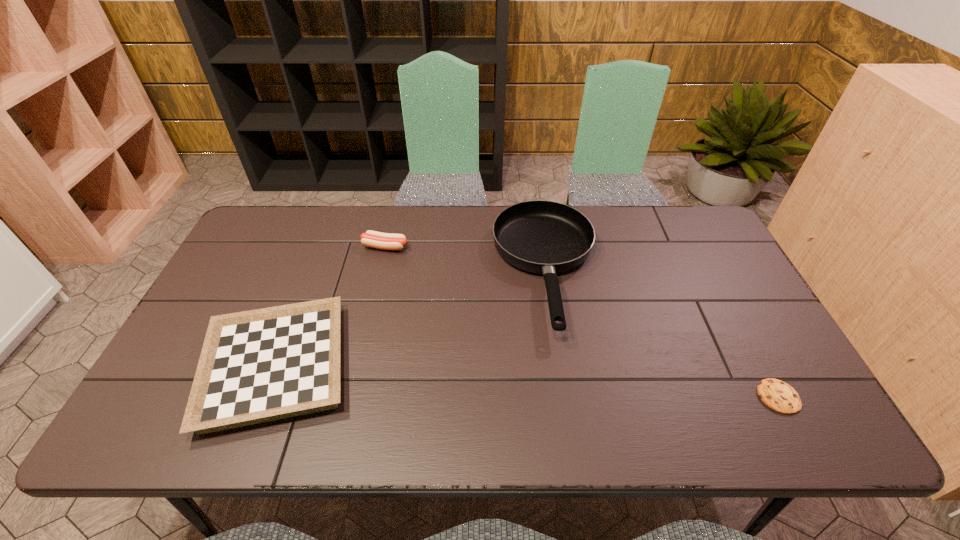
Where is `object that stands as the third closest to the checkerboard`? This screenshot has height=540, width=960. object that stands as the third closest to the checkerboard is located at coordinates (779, 396).

Identify which object is located as the nearest to the checkerboard. Please provide its 2D coordinates. Your answer should be formatted as a tuple, i.e. [(x, y)], where the tuple contains the x and y coordinates of a point satisfying the conditions above.

[(387, 241)]

Find the location of a particular element. This screenshot has width=960, height=540. vacant region that satisfies the following two spatial constraints: 1. on the front side of the rightmost object; 2. on the left side of the sausage is located at coordinates (350, 396).